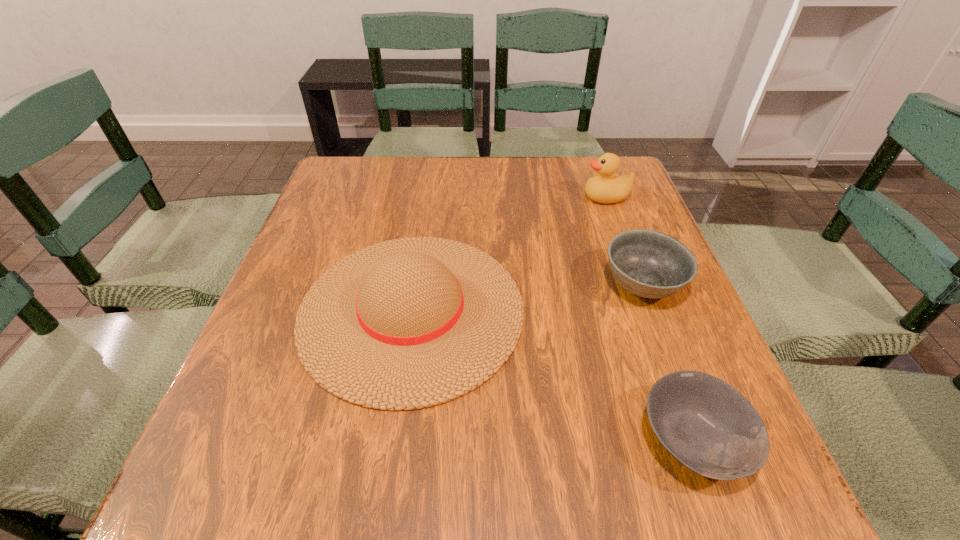
Where is `unoccupied position between the nearer bowl and the second shortest object`? unoccupied position between the nearer bowl and the second shortest object is located at coordinates (668, 362).

Identify the location of vacant space that's between the shortest object and the duck. This screenshot has height=540, width=960. (650, 319).

Identify the location of empty space between the bonnet and the duck. Image resolution: width=960 pixels, height=540 pixels. (509, 253).

Find the location of a particular element. The height and width of the screenshot is (540, 960). free spot between the bonnet and the duck is located at coordinates (509, 253).

Locate which object ranks third in proximity to the leftmost object. Please provide its 2D coordinates. Your answer should be formatted as a tuple, i.e. [(x, y)], where the tuple contains the x and y coordinates of a point satisfying the conditions above.

[(603, 187)]

The image size is (960, 540). I want to click on object identified as the closest to the third tallest object, so pyautogui.click(x=706, y=424).

Where is `vacant space that satisfies the following two spatial constraints: 1. at the beak of the farthest object; 2. on the back side of the farther bowl`? vacant space that satisfies the following two spatial constraints: 1. at the beak of the farthest object; 2. on the back side of the farther bowl is located at coordinates (638, 285).

Where is `vacant position in the image that satisfies the following two spatial constraints: 1. at the beak of the farthest object; 2. on the front side of the shorter bowl`? vacant position in the image that satisfies the following two spatial constraints: 1. at the beak of the farthest object; 2. on the front side of the shorter bowl is located at coordinates (694, 440).

Locate an element on the screen. Image resolution: width=960 pixels, height=540 pixels. vacant position in the image that satisfies the following two spatial constraints: 1. at the beak of the duck; 2. on the right side of the taller bowl is located at coordinates (638, 285).